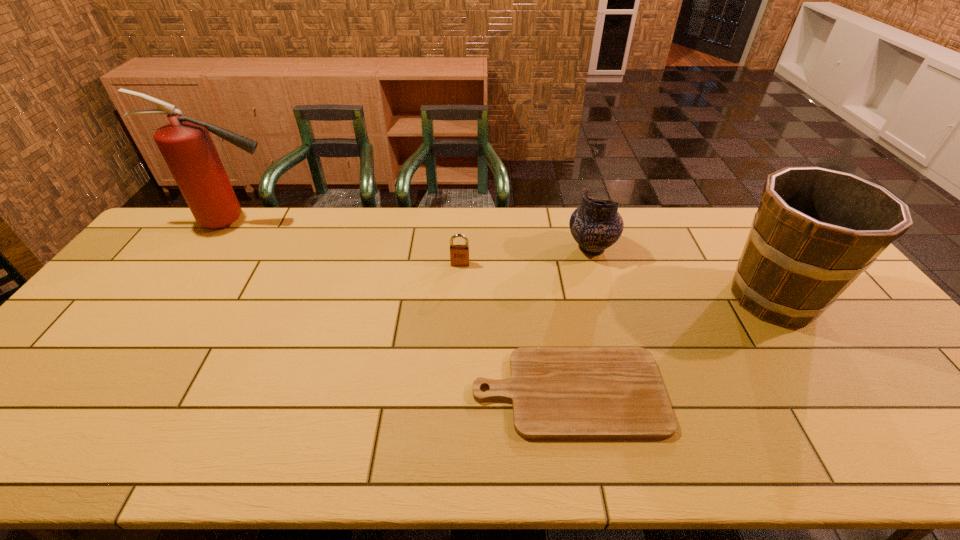
What are the coordinates of `fire extinguisher` in the screenshot? It's located at (185, 143).

This screenshot has height=540, width=960. Identify the location of the tallest object. (185, 143).

This screenshot has width=960, height=540. Identify the location of bucket. (816, 230).

You are a GUI agent. You are given a task and a screenshot of the screen. Output one action in this format:
    pyautogui.click(x=<x>, y=<y>)
    Task: Click on the fourth shortest object
    This screenshot has width=960, height=540.
    Given the screenshot: What is the action you would take?
    pyautogui.click(x=816, y=230)

The image size is (960, 540). Identify the location of pottery. (596, 225).

At what (x,y) coordinates should I click in order to perform the action: click on the second object from left to right. Please return your answer as a coordinate pair (x, y). Image resolution: width=960 pixels, height=540 pixels. Looking at the image, I should click on (459, 254).

Locate an element on the screen. The image size is (960, 540). the second shortest object is located at coordinates (459, 254).

Where is `the nearest object`? The image size is (960, 540). the nearest object is located at coordinates (557, 392).

In order to click on chopping board in this screenshot , I will do `click(557, 392)`.

You are a GUI agent. You are given a task and a screenshot of the screen. Output one action in this format:
    pyautogui.click(x=<x>, y=<y>)
    Task: Click on the vacant space situated at the nozzle of the leftmost object
    Image resolution: width=960 pixels, height=540 pixels.
    Given the screenshot: What is the action you would take?
    pyautogui.click(x=322, y=221)